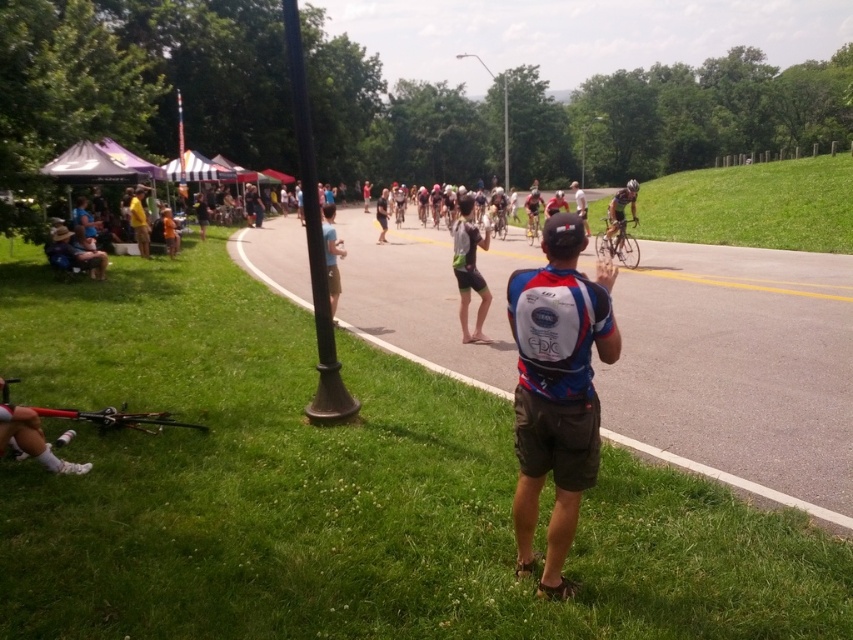
Question: Can you confirm if green grass at right is positioned below light blue fabric shirt at center?

Choices:
 (A) no
 (B) yes

Answer: (A)

Question: Which object is positioned closest to the shiny black bicycle at center?

Choices:
 (A) green grass at right
 (B) orange fabric at center

Answer: (B)

Question: Which is farther from the white mesh backpack at center?

Choices:
 (A) white fabric jersey at center
 (B) green fabric shorts at center
 (C) yellow fabric tent at left
 (D) light blue fabric shirt at center

Answer: (A)

Question: Does green grass at right have a smaller size compared to yellow fabric tent at left?

Choices:
 (A) yes
 (B) no

Answer: (B)

Question: Does green grass at lower left have a lesser width compared to white mesh backpack at center?

Choices:
 (A) no
 (B) yes

Answer: (A)

Question: Among these points, which one is nearest to the camera?

Choices:
 (A) (134, 228)
 (B) (474, 323)

Answer: (B)